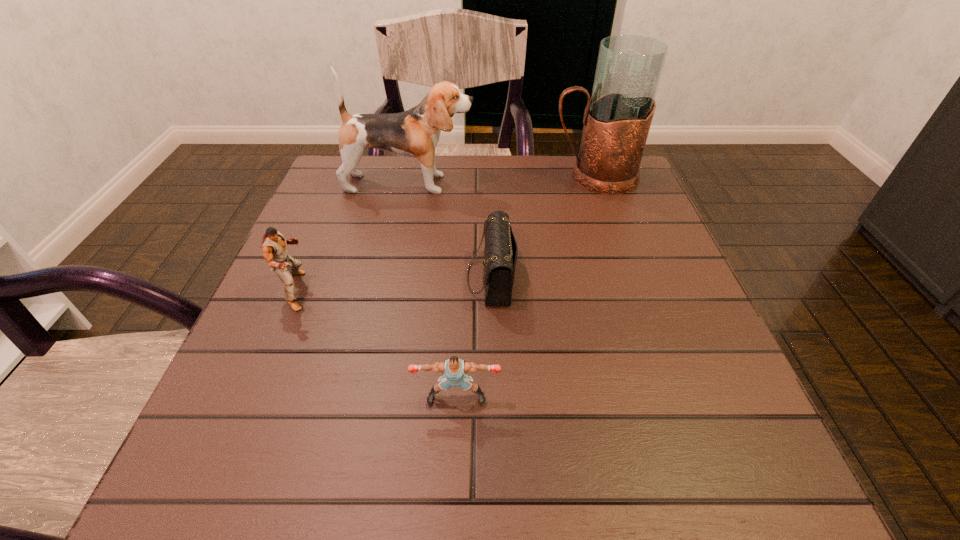
Find the location of a particular element. This screenshot has width=960, height=540. vacant space that satisfies the following two spatial constraints: 1. with the handle on the side of the rightmost object; 2. on the front-facing side of the nearer puncher is located at coordinates (672, 398).